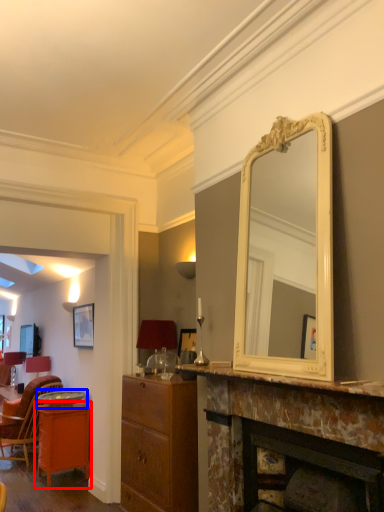
Question: Which point is closer to the camera, table (highlighted by a red box) or round table (highlighted by a blue box)?

Choices:
 (A) table
 (B) round table

Answer: (A)